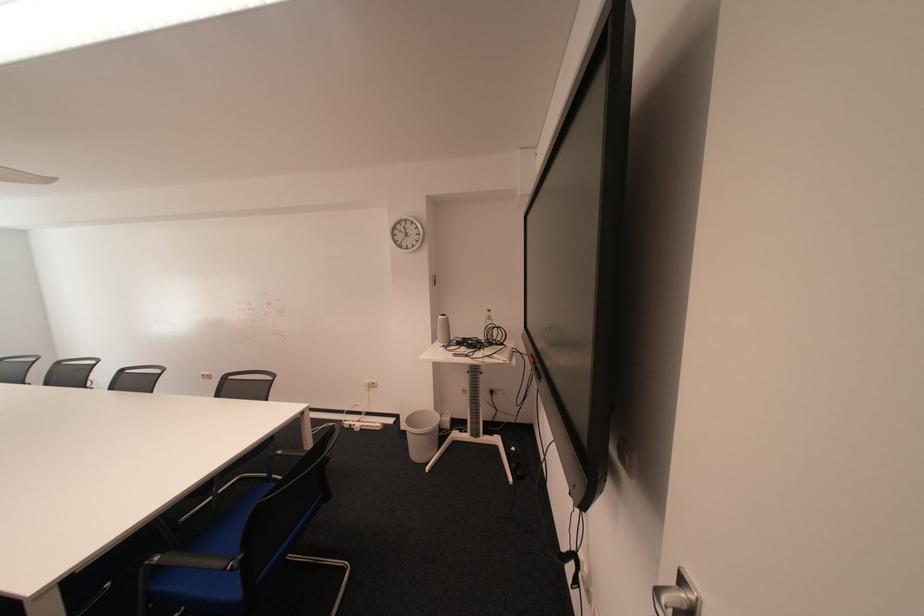
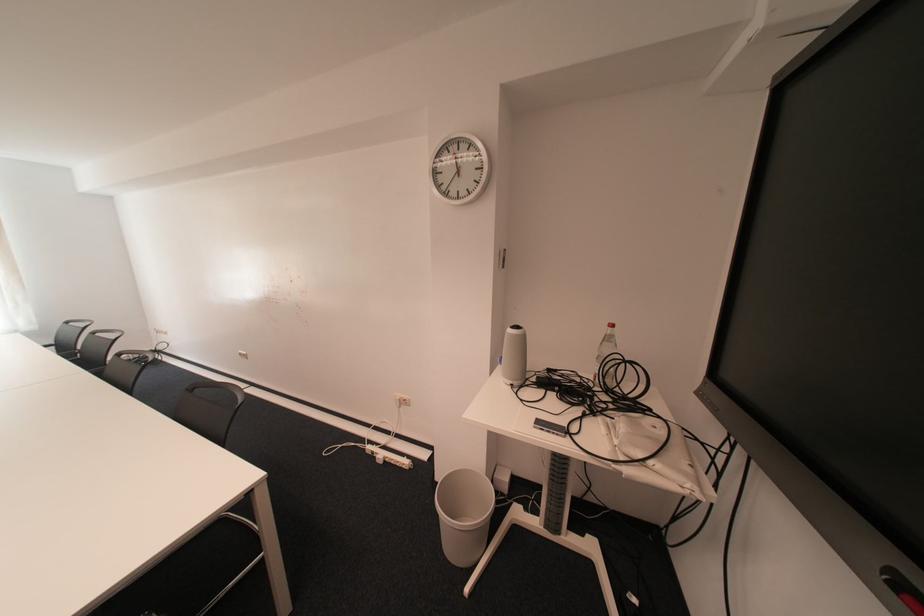
In the second image, find the point that corresponds to (x=465, y=357) in the first image.

(545, 428)